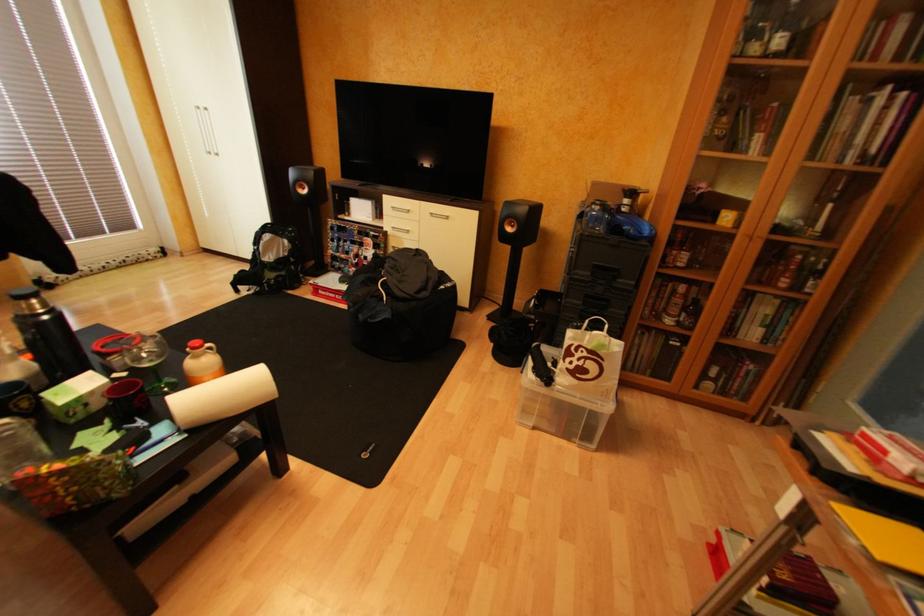
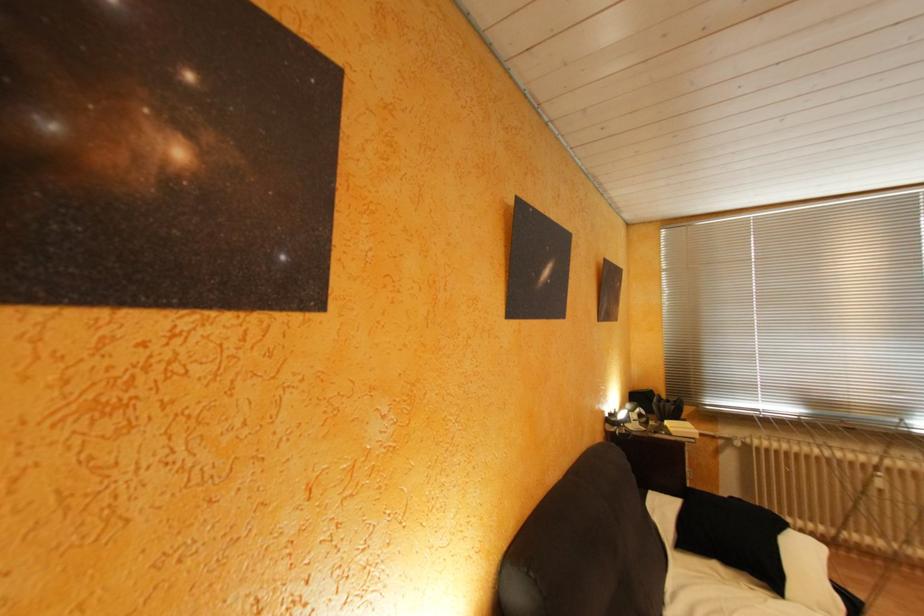
Question: The camera is either moving clockwise (left) or counter-clockwise (right) around the object. The first image is from the beginning of the video and the second image is from the end. Is the camera moving left or right when shooting the video?

Choices:
 (A) Left
 (B) Right

Answer: (B)